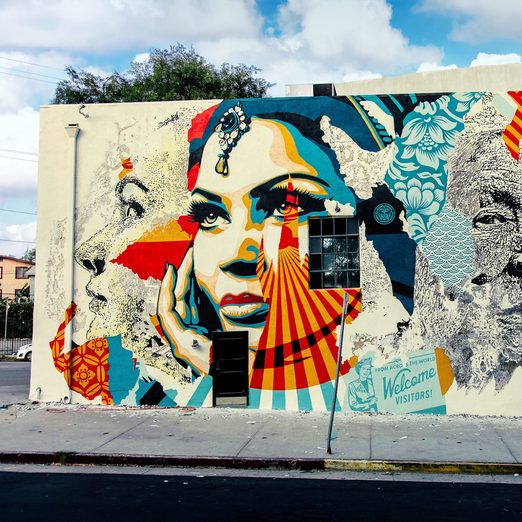
What are the coordinates of `mural female face` in the screenshot? It's located at (242, 237).